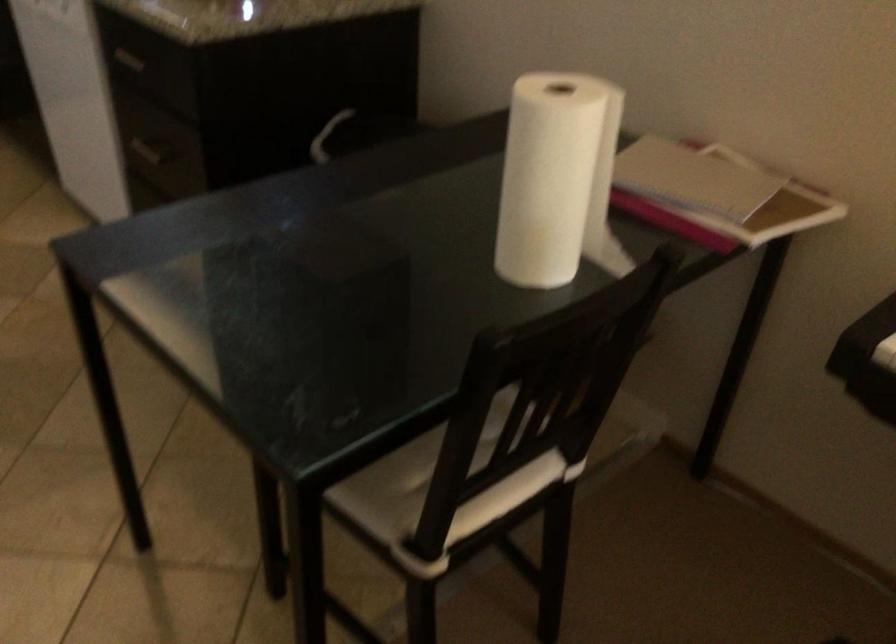
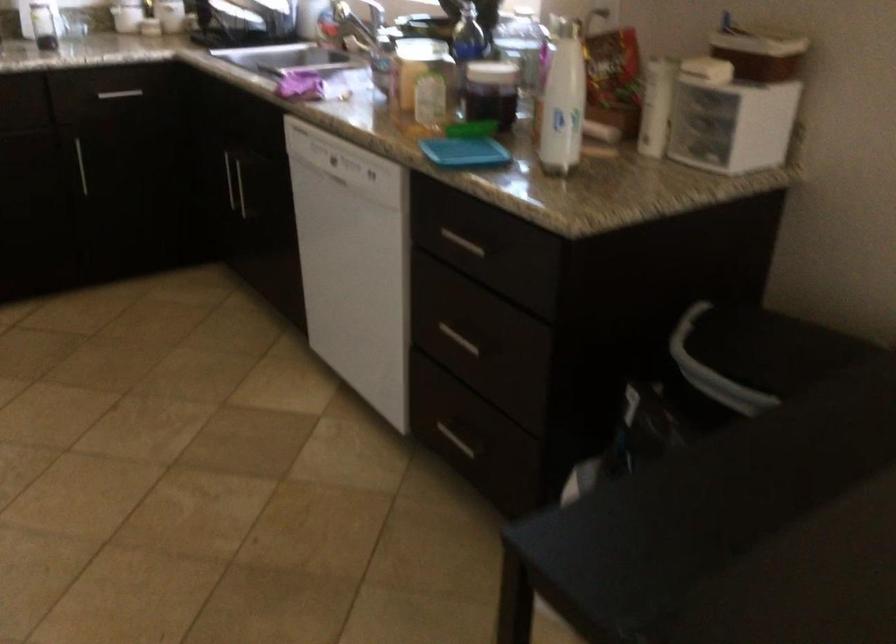
Question: The camera is either moving clockwise (left) or counter-clockwise (right) around the object. The first image is from the beginning of the video and the second image is from the end. Is the camera moving left or right when shooting the video?

Choices:
 (A) Left
 (B) Right

Answer: (B)